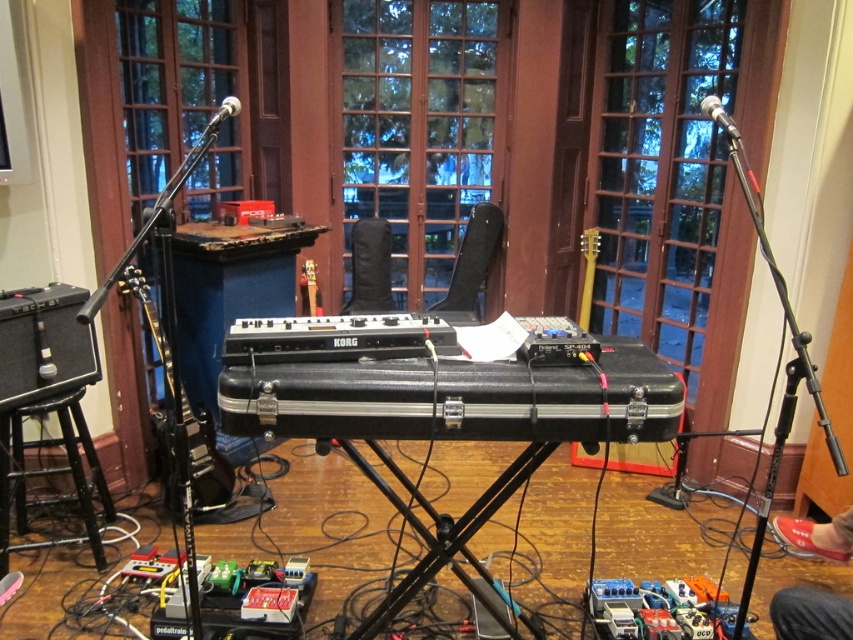
Question: Among these objects, which one is farthest from the camera?

Choices:
 (A) matte brown guitar at center
 (B) black wood stool at lower left
 (C) black glossy electric guitar at left
 (D) yellow matte guitar at center

Answer: (A)

Question: Does black wood stool at lower left come behind black glossy electric guitar at left?

Choices:
 (A) yes
 (B) no

Answer: (A)

Question: Which point appears closest to the camera in this image?

Choices:
 (A) (587, 230)
 (B) (224, 504)
 (C) (71, 464)
 (D) (312, 284)

Answer: (C)

Question: Is black wood stool at lower left to the right of matte brown guitar at center from the viewer's perspective?

Choices:
 (A) no
 (B) yes

Answer: (A)

Question: Is black wood stool at lower left in front of matte brown guitar at center?

Choices:
 (A) yes
 (B) no

Answer: (A)

Question: Which of these objects is positioned farthest from the black glossy electric guitar at left?

Choices:
 (A) black wood stool at lower left
 (B) yellow matte guitar at center
 (C) matte brown guitar at center

Answer: (B)